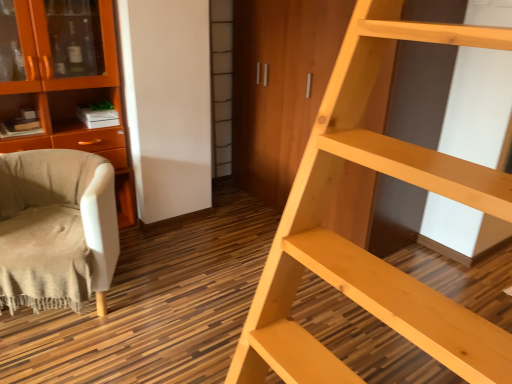
Describe the element at coordinates (65, 82) in the screenshot. The height and width of the screenshot is (384, 512). I see `orange wood cabinet at left` at that location.

Measure the distance between light wood ladder at right and camera.

28.00 inches.

The image size is (512, 384). What are the coordinates of `orange wood cabinet at left` in the screenshot? It's located at (65, 82).

Does orange wood cabinet at left have a smaller size compared to light wood ladder at right?

Correct, orange wood cabinet at left occupies less space than light wood ladder at right.

Is orange wood cabinet at left oriented towards light wood ladder at right?

Yes, orange wood cabinet at left faces towards light wood ladder at right.

From the image's perspective, is orange wood cabinet at left located beneath light wood ladder at right?

No, from the image's perspective, orange wood cabinet at left is not beneath light wood ladder at right.

How far apart are light wood ladder at right and orange wood cabinet at left?

The distance of light wood ladder at right from orange wood cabinet at left is 1.81 meters.

What's the angular difference between light wood ladder at right and orange wood cabinet at left's facing directions?

89.6 degrees.

Which object is positioned more to the left, light wood ladder at right or orange wood cabinet at left?

Positioned to the left is orange wood cabinet at left.

Is light wood ladder at right with orange wood cabinet at left?

No.

You are a GUI agent. You are given a task and a screenshot of the screen. Output one action in this format:
    pyautogui.click(x=<x>, y=<y>)
    Task: Click on the chair that is on the left side of light wood ladder at right
    This screenshot has height=384, width=512.
    Given the screenshot: What is the action you would take?
    pyautogui.click(x=58, y=227)

Do you think light wood ladder at right is within beige fabric chair at left, or outside of it?

light wood ladder at right is not inside beige fabric chair at left, it's outside.

What's the angular difference between light wood ladder at right and beige fabric chair at left's facing directions?

61.9 degrees.

Are light wood ladder at right and beige fabric chair at left located far from each other?

Yes, light wood ladder at right is far from beige fabric chair at left.

Is beige fabric chair at left positioned with its back to light wood ladder at right?

No, beige fabric chair at left is not facing away from light wood ladder at right.

From a real-world perspective, which object rests below the other?

In real-world perspective, beige fabric chair at left is lower.

Is beige fabric chair at left outside of orange wood cabinet at left?

That's correct, beige fabric chair at left is outside of orange wood cabinet at left.

Who is smaller, beige fabric chair at left or orange wood cabinet at left?

With smaller size is beige fabric chair at left.

Does beige fabric chair at left turn towards orange wood cabinet at left?

No, beige fabric chair at left is not facing towards orange wood cabinet at left.

Does orange wood cabinet at left have a greater height compared to beige fabric chair at left?

Indeed, orange wood cabinet at left has a greater height compared to beige fabric chair at left.

Considering the sizes of orange wood cabinet at left and beige fabric chair at left in the image, is orange wood cabinet at left bigger or smaller than beige fabric chair at left?

orange wood cabinet at left is bigger than beige fabric chair at left.

In terms of width, does orange wood cabinet at left look wider or thinner when compared to beige fabric chair at left?

In the image, orange wood cabinet at left appears to be more narrow than beige fabric chair at left.

Is orange wood cabinet at left positioned far away from beige fabric chair at left?

That's not correct — orange wood cabinet at left is a little close to beige fabric chair at left.

Where is `cabinetry below the light wood ladder at right (from a real-world perspective)`? The width and height of the screenshot is (512, 384). cabinetry below the light wood ladder at right (from a real-world perspective) is located at coordinates (65, 82).

Find the location of a particular element. Image resolution: width=512 pixels, height=384 pixels. ladder on the right of orange wood cabinet at left is located at coordinates (358, 246).

Which object lies further to the anchor point orange wood cabinet at left, beige fabric chair at left or light wood ladder at right?

light wood ladder at right lies further to orange wood cabinet at left than the other object.

Which object lies nearer to the anchor point orange wood cabinet at left, light wood ladder at right or beige fabric chair at left?

Based on the image, beige fabric chair at left appears to be nearer to orange wood cabinet at left.

Consider the image. Which object lies nearer to the anchor point beige fabric chair at left, light wood ladder at right or orange wood cabinet at left?

orange wood cabinet at left is positioned closer to the anchor beige fabric chair at left.

Which object lies further to the anchor point beige fabric chair at left, orange wood cabinet at left or light wood ladder at right?

light wood ladder at right.

From the image, which object appears to be farther from light wood ladder at right, beige fabric chair at left or orange wood cabinet at left?

orange wood cabinet at left lies further to light wood ladder at right than the other object.

Looking at the image, which one is located closer to light wood ladder at right, orange wood cabinet at left or beige fabric chair at left?

beige fabric chair at left lies closer to light wood ladder at right than the other object.

This screenshot has width=512, height=384. Find the location of `chair between light wood ladder at right and orange wood cabinet at left along the z-axis`. chair between light wood ladder at right and orange wood cabinet at left along the z-axis is located at coordinates (58, 227).